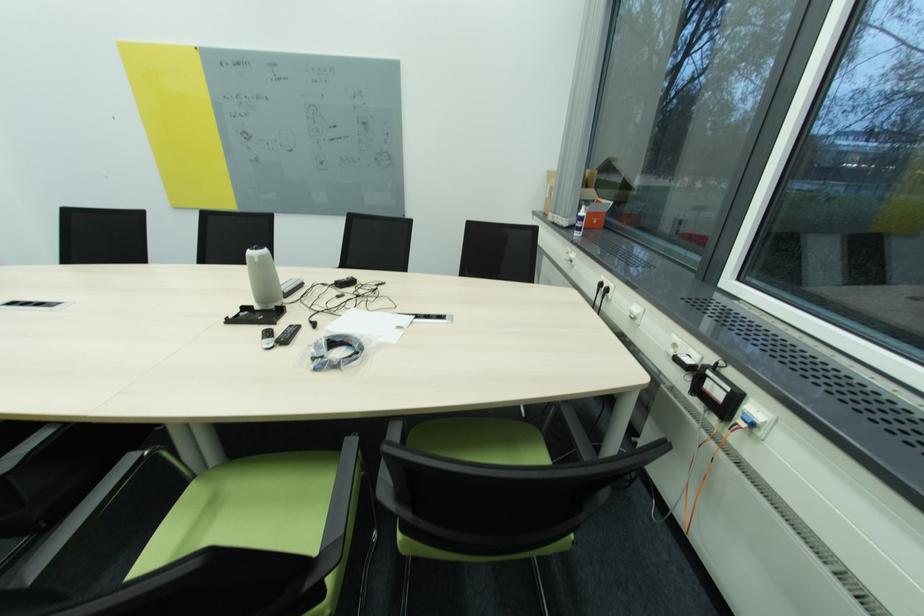
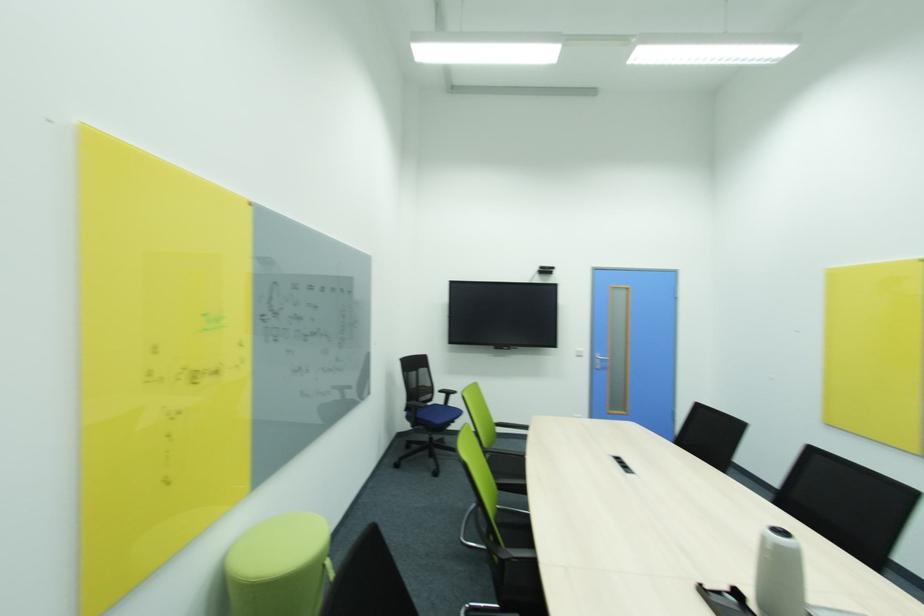
Locate, in the second image, the point that corresponds to (261,262) in the first image.

(774, 548)